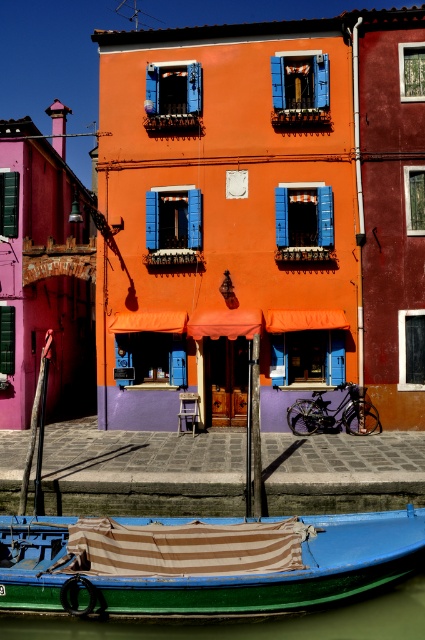
Question: Can you confirm if green painted wood boat at lower center is thinner than green smooth water at lower left?

Choices:
 (A) yes
 (B) no

Answer: (B)

Question: Which point is closer to the camera?

Choices:
 (A) green painted wood boat at lower center
 (B) green smooth water at lower left

Answer: (A)

Question: Is green painted wood boat at lower center closer to camera compared to green smooth water at lower left?

Choices:
 (A) no
 (B) yes

Answer: (B)

Question: Which of the following is the closest to the observer?

Choices:
 (A) (73, 547)
 (B) (139, 627)

Answer: (B)

Question: Does green painted wood boat at lower center have a smaller size compared to green smooth water at lower left?

Choices:
 (A) no
 (B) yes

Answer: (A)